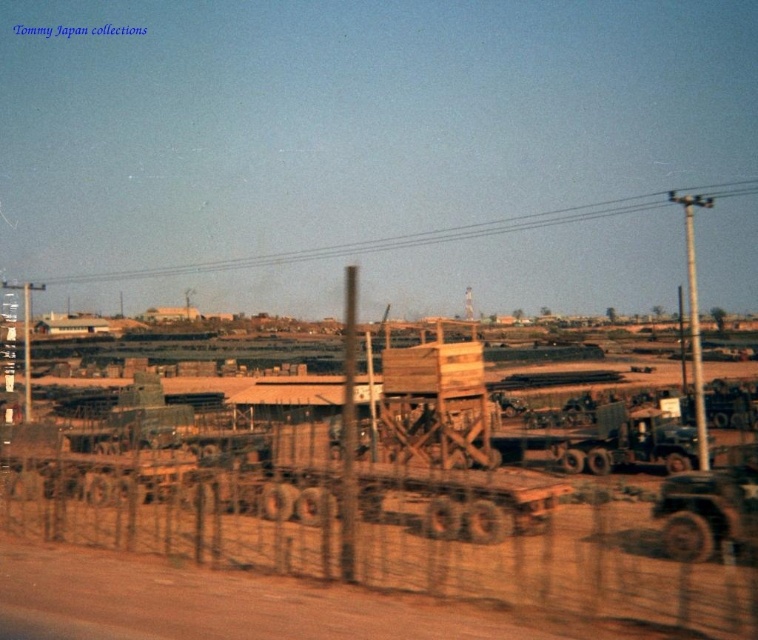
You are a worker who needs to place a 6.5 feet long wooden beam between the wooden planks at center and the brown wire mesh fence at lower center. Can you fit the beam horizontally between them without bending it?

The distance between the wooden planks at center and the brown wire mesh fence at lower center is 7.71 feet, which is greater than the beam length of 6.5 feet. Therefore, the beam can be placed horizontally between them without bending.

You are a delivery person trying to navigate through the military area. You see the wooden planks at center and the brown wire mesh fence at lower center. Which object is positioned to the right of the other?

The wooden planks at center are to the right of the brown wire mesh fence at lower center.

Consider the image. You are a delivery person who needs to load a package onto the wooden planks at center. The package is 1.2 meters tall. The brown wire mesh fence at lower center is blocking the path. Can you lift the package over the fence without tilting it?

The wooden planks at center is much taller than the brown wire mesh fence at lower center, so yes, the package can be lifted over the fence without tilting it since the wooden planks are higher.